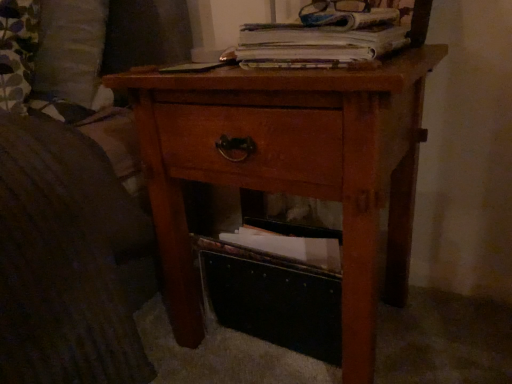
Question: Considering the relative positions of white paper at upper center and wooden nightstand at center in the image provided, is white paper at upper center behind wooden nightstand at center?

Choices:
 (A) yes
 (B) no

Answer: (A)

Question: Is white paper at upper center oriented away from wooden nightstand at center?

Choices:
 (A) no
 (B) yes

Answer: (A)

Question: Considering the relative sizes of white paper at upper center and wooden nightstand at center in the image provided, is white paper at upper center bigger than wooden nightstand at center?

Choices:
 (A) no
 (B) yes

Answer: (A)

Question: Does white paper at upper center have a lesser width compared to wooden nightstand at center?

Choices:
 (A) no
 (B) yes

Answer: (B)

Question: Does white paper at upper center turn towards wooden nightstand at center?

Choices:
 (A) no
 (B) yes

Answer: (A)

Question: Considering the relative sizes of white paper at upper center and wooden nightstand at center in the image provided, is white paper at upper center smaller than wooden nightstand at center?

Choices:
 (A) yes
 (B) no

Answer: (A)

Question: Does black fabric storage box at lower center appear on the right side of wooden nightstand at center?

Choices:
 (A) no
 (B) yes

Answer: (B)

Question: Is black fabric storage box at lower center closer to camera compared to wooden nightstand at center?

Choices:
 (A) no
 (B) yes

Answer: (A)

Question: Can you confirm if black fabric storage box at lower center is positioned to the left of wooden nightstand at center?

Choices:
 (A) yes
 (B) no

Answer: (B)

Question: Is black fabric storage box at lower center not inside wooden nightstand at center?

Choices:
 (A) no
 (B) yes

Answer: (A)

Question: From a real-world perspective, is black fabric storage box at lower center under wooden nightstand at center?

Choices:
 (A) yes
 (B) no

Answer: (A)

Question: Does black fabric storage box at lower center have a lesser height compared to wooden nightstand at center?

Choices:
 (A) no
 (B) yes

Answer: (B)

Question: Is white paper at upper center with black fabric storage box at lower center?

Choices:
 (A) yes
 (B) no

Answer: (B)